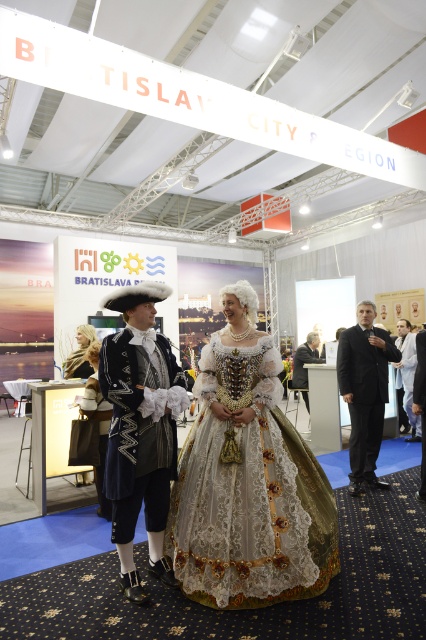
Question: Which of the following is the farthest from the observer?

Choices:
 (A) (138, 396)
 (B) (86, 376)

Answer: (B)

Question: Can you confirm if white fabric suit at center is positioned above dark gray suit at center?

Choices:
 (A) no
 (B) yes

Answer: (B)

Question: Is matte black coat at center bigger than smooth cream scarf at center?

Choices:
 (A) yes
 (B) no

Answer: (A)

Question: Estimate the real-world distances between objects in this image. Which object is farther from the dark gray suit at center?

Choices:
 (A) lace fabric dress at center
 (B) white fabric suit at center
 (C) smooth cream scarf at center
 (D) black smooth suit at right

Answer: (A)

Question: Which is nearer to the matte black coat at center?

Choices:
 (A) white fabric suit at center
 (B) smooth cream scarf at center

Answer: (B)

Question: Can you confirm if matte black coat at center is positioned below dark gray suit at center?

Choices:
 (A) yes
 (B) no

Answer: (B)